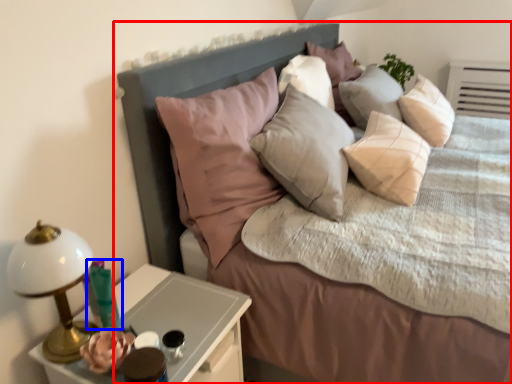
Question: Which point is further to the camera, bed (highlighted by a red box) or candle holder (highlighted by a blue box)?

Choices:
 (A) bed
 (B) candle holder

Answer: (B)